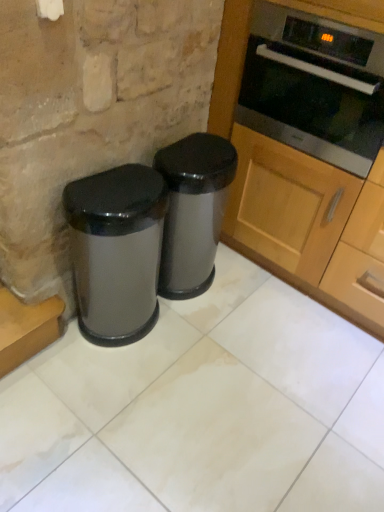
Image resolution: width=384 pixels, height=512 pixels. What do you see at coordinates (302, 167) in the screenshot? I see `wooden cabinet at right` at bounding box center [302, 167].

Identify the location of glossy metallic trash can at lower left, marked as the first waste container in a left-to-right arrangement. The width and height of the screenshot is (384, 512). (116, 251).

At what (x,y) coordinates should I click in order to perform the action: click on satin silver trash can at center, which is the first waste container in right-to-left order. Please return your answer as a coordinate pair (x, y). This screenshot has height=512, width=384. Looking at the image, I should click on (193, 211).

This screenshot has width=384, height=512. I want to click on wooden cabinet at right, so click(302, 167).

Can we say glossy metallic trash can at lower left, which appears as the 2th waste container when viewed from the right, lies outside wooden cabinet at right?

glossy metallic trash can at lower left, which appears as the 2th waste container when viewed from the right, lies outside wooden cabinet at right's area.

Find the location of `cabinetry positioned vertically above the glossy metallic trash can at lower left, marked as the first waste container in a left-to-right arrangement (from a real-world perspective)`. cabinetry positioned vertically above the glossy metallic trash can at lower left, marked as the first waste container in a left-to-right arrangement (from a real-world perspective) is located at coordinates (302, 167).

Is glossy metallic trash can at lower left, which appears as the 2th waste container when viewed from the right, in front of or behind wooden cabinet at right in the image?

Visually, glossy metallic trash can at lower left, which appears as the 2th waste container when viewed from the right, is located behind wooden cabinet at right.

How different are the orientations of glossy metallic trash can at lower left, marked as the first waste container in a left-to-right arrangement, and wooden cabinet at right in degrees?

The facing directions of glossy metallic trash can at lower left, marked as the first waste container in a left-to-right arrangement, and wooden cabinet at right are 89.6 degrees apart.

Which of these two, satin silver trash can at center, the second waste container viewed from the left, or wooden cabinet at right, stands taller?

With more height is wooden cabinet at right.

From the picture: Is satin silver trash can at center, which is the first waste container in right-to-left order, not inside wooden cabinet at right?

Absolutely, satin silver trash can at center, which is the first waste container in right-to-left order, is external to wooden cabinet at right.

Which waste container is the 2nd one when counting from the back of the wooden cabinet at right? Please provide its 2D coordinates.

[(193, 211)]

Is stainless steel oven at upper right placed right next to satin silver trash can at center, the second waste container viewed from the left?

No, stainless steel oven at upper right is not beside satin silver trash can at center, the second waste container viewed from the left.

Could you tell me if stainless steel oven at upper right is facing satin silver trash can at center, which is the first waste container in right-to-left order?

No, stainless steel oven at upper right is not aimed at satin silver trash can at center, which is the first waste container in right-to-left order.

Is satin silver trash can at center, which is the first waste container in right-to-left order, surrounded by stainless steel oven at upper right?

Actually, satin silver trash can at center, which is the first waste container in right-to-left order, is outside stainless steel oven at upper right.

From the image's perspective, which one is positioned lower, stainless steel oven at upper right or wooden cabinet at right?

From the image's view, wooden cabinet at right is below.

Is wooden cabinet at right completely or partially inside stainless steel oven at upper right?

No.

In terms of height, does stainless steel oven at upper right look taller or shorter compared to wooden cabinet at right?

Clearly, stainless steel oven at upper right is shorter compared to wooden cabinet at right.

From a real-world perspective, which object stands above the other?

From a 3D spatial view, wooden cabinet at right is above.

From the image's perspective, is wooden cabinet at right below satin silver trash can at center, which is the first waste container in right-to-left order?

No.

Could you measure the distance between wooden cabinet at right and satin silver trash can at center, the second waste container viewed from the left?

The distance of wooden cabinet at right from satin silver trash can at center, the second waste container viewed from the left, is 15.00 inches.

Does wooden cabinet at right have a greater height compared to glossy metallic trash can at lower left, marked as the first waste container in a left-to-right arrangement?

Yes, wooden cabinet at right is taller than glossy metallic trash can at lower left, marked as the first waste container in a left-to-right arrangement.

Does point (361, 32) come in front of point (162, 195)?

Yes, it is.

This screenshot has height=512, width=384. In order to click on cabinetry above the glossy metallic trash can at lower left, which appears as the 2th waste container when viewed from the right (from a real-world perspective) in this screenshot , I will do `click(302, 167)`.

Could you tell me if wooden cabinet at right is turned towards glossy metallic trash can at lower left, which appears as the 2th waste container when viewed from the right?

Yes, wooden cabinet at right is aimed at glossy metallic trash can at lower left, which appears as the 2th waste container when viewed from the right.

Between stainless steel oven at upper right and glossy metallic trash can at lower left, which appears as the 2th waste container when viewed from the right, which one appears on the left side from the viewer's perspective?

glossy metallic trash can at lower left, which appears as the 2th waste container when viewed from the right.

Is stainless steel oven at upper right located outside glossy metallic trash can at lower left, marked as the first waste container in a left-to-right arrangement?

Indeed, stainless steel oven at upper right is completely outside glossy metallic trash can at lower left, marked as the first waste container in a left-to-right arrangement.

Is stainless steel oven at upper right directly adjacent to glossy metallic trash can at lower left, which appears as the 2th waste container when viewed from the right?

stainless steel oven at upper right and glossy metallic trash can at lower left, which appears as the 2th waste container when viewed from the right, are not in contact.

The width and height of the screenshot is (384, 512). There is a glossy metallic trash can at lower left, which appears as the 2th waste container when viewed from the right. What are the coordinates of `cabinetry above it (from a real-world perspective)` in the screenshot? It's located at (302, 167).

From a real-world perspective, which waste container is the 1st one underneath the wooden cabinet at right? Please provide its 2D coordinates.

[(193, 211)]

When comparing their distances from wooden cabinet at right, does stainless steel oven at upper right or satin silver trash can at center, the second waste container viewed from the left, seem closer?

stainless steel oven at upper right is closer to wooden cabinet at right.

When comparing their distances from satin silver trash can at center, the second waste container viewed from the left, does stainless steel oven at upper right or wooden cabinet at right seem closer?

Among the two, wooden cabinet at right is located nearer to satin silver trash can at center, the second waste container viewed from the left.

Based on their spatial positions, is satin silver trash can at center, which is the first waste container in right-to-left order, or stainless steel oven at upper right further from wooden cabinet at right?

satin silver trash can at center, which is the first waste container in right-to-left order, is further to wooden cabinet at right.

When comparing their distances from glossy metallic trash can at lower left, which appears as the 2th waste container when viewed from the right, does satin silver trash can at center, the second waste container viewed from the left, or wooden cabinet at right seem further?

wooden cabinet at right.

Consider the image. Based on their spatial positions, is wooden cabinet at right or stainless steel oven at upper right further from satin silver trash can at center, the second waste container viewed from the left?

stainless steel oven at upper right.

When comparing their distances from glossy metallic trash can at lower left, marked as the first waste container in a left-to-right arrangement, does stainless steel oven at upper right or wooden cabinet at right seem closer?

Among the two, wooden cabinet at right is located nearer to glossy metallic trash can at lower left, marked as the first waste container in a left-to-right arrangement.

Which object lies further to the anchor point wooden cabinet at right, stainless steel oven at upper right or glossy metallic trash can at lower left, marked as the first waste container in a left-to-right arrangement?

The object further to wooden cabinet at right is glossy metallic trash can at lower left, marked as the first waste container in a left-to-right arrangement.

When comparing their distances from wooden cabinet at right, does satin silver trash can at center, the second waste container viewed from the left, or glossy metallic trash can at lower left, marked as the first waste container in a left-to-right arrangement, seem further?

Based on the image, glossy metallic trash can at lower left, marked as the first waste container in a left-to-right arrangement, appears to be further to wooden cabinet at right.

Image resolution: width=384 pixels, height=512 pixels. In order to click on waste container between glossy metallic trash can at lower left, which appears as the 2th waste container when viewed from the right, and wooden cabinet at right, in the horizontal direction in this screenshot , I will do `click(193, 211)`.

Find the location of a particular element. cabinetry situated between satin silver trash can at center, which is the first waste container in right-to-left order, and stainless steel oven at upper right from left to right is located at coordinates (302, 167).

The height and width of the screenshot is (512, 384). Identify the location of cabinetry situated between glossy metallic trash can at lower left, marked as the first waste container in a left-to-right arrangement, and stainless steel oven at upper right from left to right. (302, 167).

You are a GUI agent. You are given a task and a screenshot of the screen. Output one action in this format:
    pyautogui.click(x=<x>, y=<y>)
    Task: Click on the waste container between glossy metallic trash can at lower left, which appears as the 2th waste container when viewed from the right, and stainless steel oven at upper right, in the horizontal direction
    Image resolution: width=384 pixels, height=512 pixels.
    Given the screenshot: What is the action you would take?
    pyautogui.click(x=193, y=211)